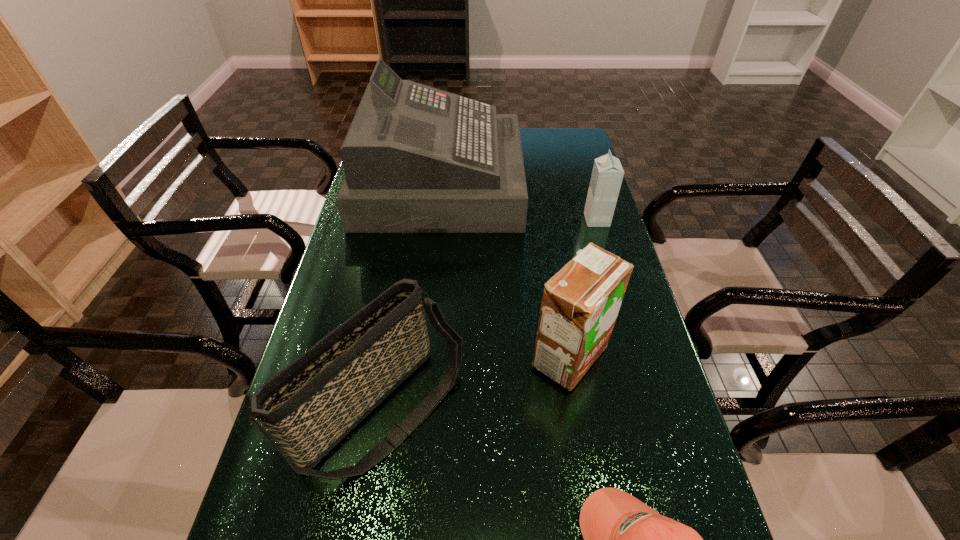
This screenshot has width=960, height=540. I want to click on vacant area situated on the front label of the right carton, so click(x=561, y=220).

Where is `vacant space situated on the front label of the right carton`? vacant space situated on the front label of the right carton is located at coordinates (548, 220).

At what (x,y) coordinates should I click in order to perform the action: click on vacant space located 0.370m on the front label of the right carton. Please return your answer as a coordinate pair (x, y). This screenshot has width=960, height=540. Looking at the image, I should click on (471, 220).

Image resolution: width=960 pixels, height=540 pixels. Find the location of `vacant space situated 0.110m on the back of the handbag`. vacant space situated 0.110m on the back of the handbag is located at coordinates (398, 308).

At what (x,y) coordinates should I click in order to perform the action: click on object located at the far edge. Please return your answer as a coordinate pair (x, y). Looking at the image, I should click on (417, 159).

This screenshot has width=960, height=540. Find the location of `cash register present at the left edge`. cash register present at the left edge is located at coordinates (417, 159).

Identify the location of handbag that is at the left edge. Image resolution: width=960 pixels, height=540 pixels. (308, 407).

This screenshot has height=540, width=960. Identify the location of object present at the far left corner. (417, 159).

This screenshot has height=540, width=960. In order to click on free spot at the left edge of the desktop in this screenshot , I will do `click(372, 256)`.

At what (x,y) coordinates should I click in order to perform the action: click on free space at the right edge. Please return your answer as a coordinate pair (x, y). This screenshot has height=540, width=960. Looking at the image, I should click on (671, 470).